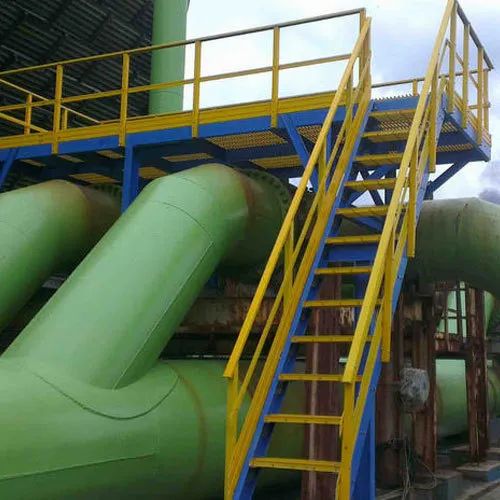
Locate an element on the screen. 1 left side of stair railing is located at coordinates (228, 401).